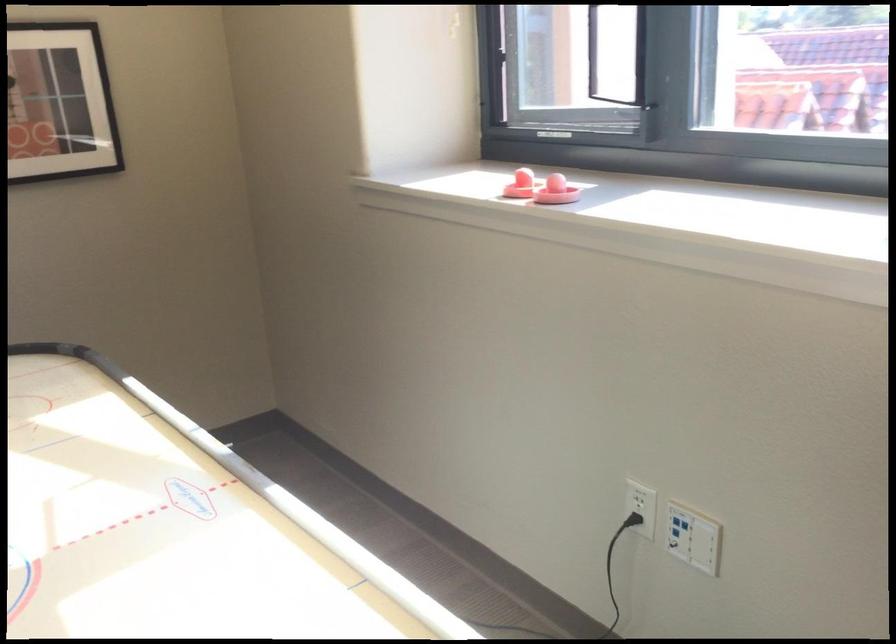
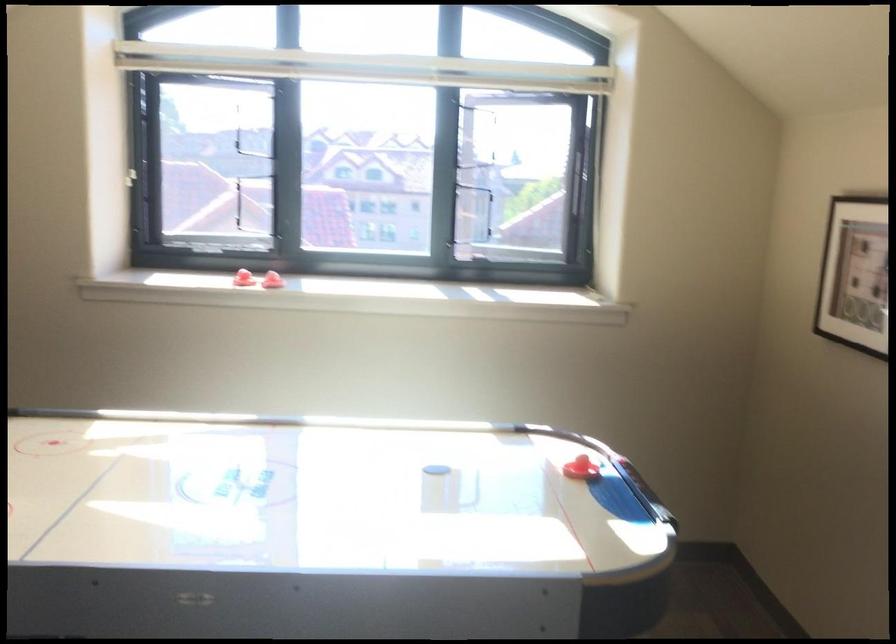
Question: I am providing you with two images of the same scene from different viewpoints. After the viewpoint changes to image2, which objects are now occluded?

Choices:
 (A) red air hockey striker
 (B) black air hockey puck
 (C) white wall button
 (D) blue futon sitting surface

Answer: (C)